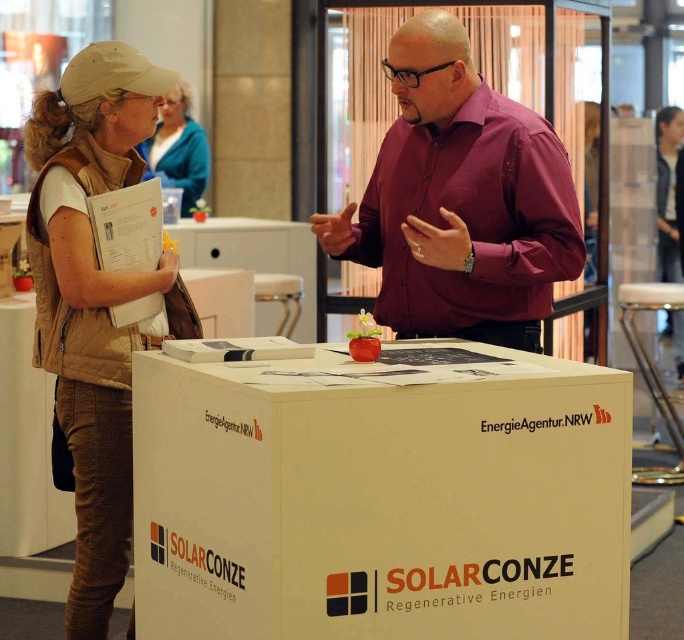
Question: Does white cardboard box at center appear on the left side of brown fabric vest at left?

Choices:
 (A) yes
 (B) no

Answer: (B)

Question: Can you confirm if burgundy shirt at center is bigger than brown fabric vest at left?

Choices:
 (A) no
 (B) yes

Answer: (B)

Question: Which point is closer to the camera?

Choices:
 (A) white cardboard box at center
 (B) burgundy shirt at center
 (C) brown fabric vest at left

Answer: (A)

Question: Which object appears closest to the camera in this image?

Choices:
 (A) burgundy shirt at center
 (B) brown fabric vest at left
 (C) white cardboard box at center
 (D) blue fabric jacket at upper center

Answer: (C)

Question: Which object appears farthest from the camera in this image?

Choices:
 (A) burgundy shirt at center
 (B) brown fabric vest at left

Answer: (B)

Question: Where is brown fabric vest at left located in relation to blue fabric jacket at upper center in the image?

Choices:
 (A) below
 (B) above

Answer: (A)